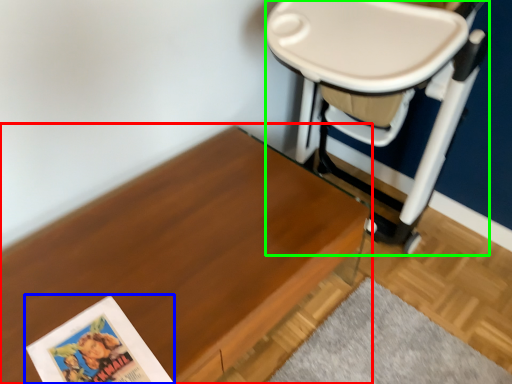
Question: Considering the real-world distances, which object is closest to table (highlighted by a red box)? paperback book (highlighted by a blue box) or swivel chair (highlighted by a green box).

Choices:
 (A) paperback book
 (B) swivel chair

Answer: (A)